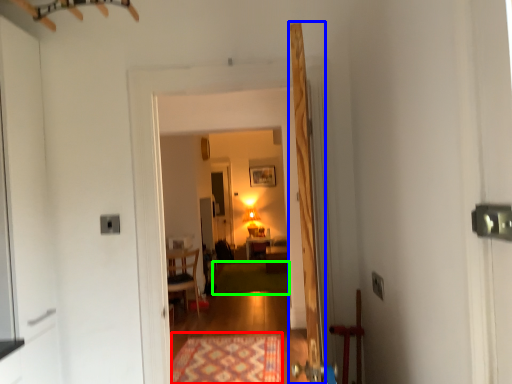
Question: Which object is the farthest from mat (highlighted by a red box)? Choose among these: door (highlighted by a blue box) or mat (highlighted by a green box).

Choices:
 (A) door
 (B) mat

Answer: (B)